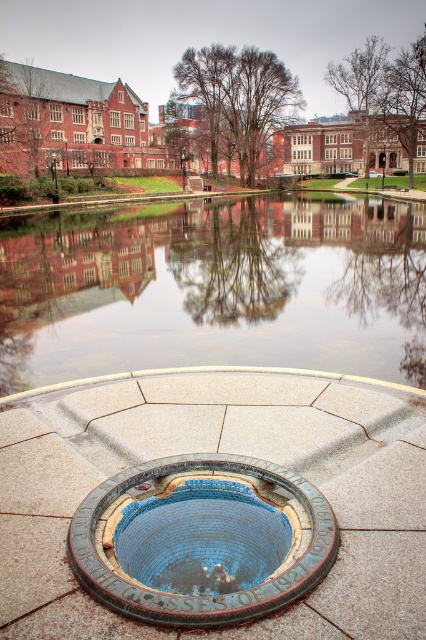
Question: Observing the image, what is the correct spatial positioning of reflective glass lake at center in reference to blue mosaic pool at center?

Choices:
 (A) below
 (B) above

Answer: (B)

Question: Which object is the closest to the blue mosaic pool at center?

Choices:
 (A) blue mosaic tile at center
 (B) reflective glass lake at center

Answer: (A)

Question: Is blue mosaic tile at center to the right of reflective glass lake at center from the viewer's perspective?

Choices:
 (A) no
 (B) yes

Answer: (A)

Question: Which point appears farthest from the camera in this image?

Choices:
 (A) (29, 340)
 (B) (302, 486)
 (C) (397, 387)

Answer: (A)

Question: Can you confirm if blue mosaic tile at center is thinner than blue mosaic pool at center?

Choices:
 (A) no
 (B) yes

Answer: (A)

Question: Which point is closer to the camera?

Choices:
 (A) (305, 563)
 (B) (402, 316)

Answer: (A)